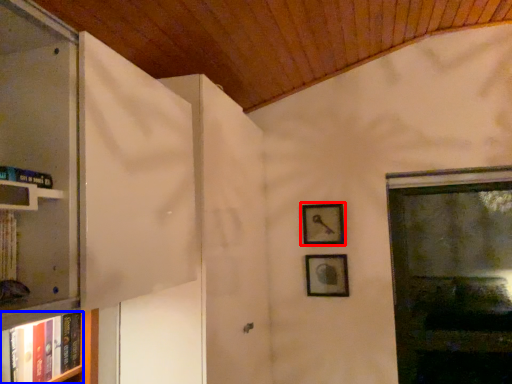
Question: Which point is closer to the camera, picture frame (highlighted by a red box) or book (highlighted by a blue box)?

Choices:
 (A) picture frame
 (B) book

Answer: (B)